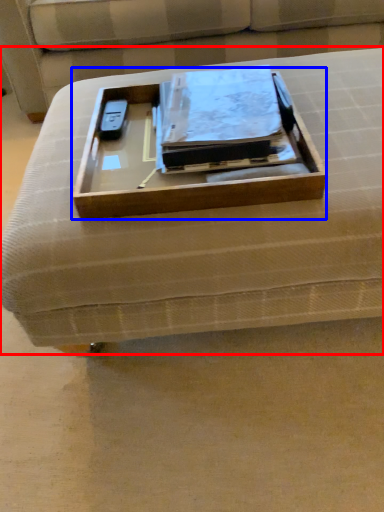
Question: Which object is closer to the camera taking this photo, furniture (highlighted by a red box) or box (highlighted by a blue box)?

Choices:
 (A) furniture
 (B) box

Answer: (A)